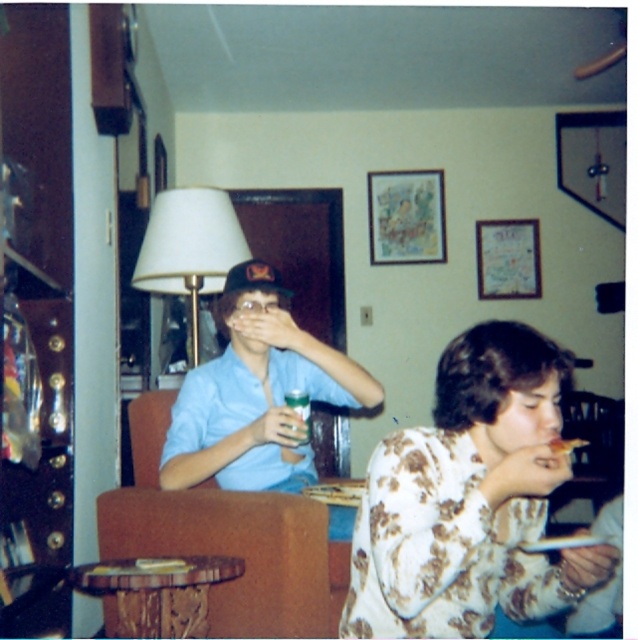
Between white fabric lampshade at upper left and white paper plate at lower right, which one has less height?

white paper plate at lower right is shorter.

Which is behind, point (191, 195) or point (581, 445)?

Point (191, 195)

Find the location of a particular element. The height and width of the screenshot is (640, 638). white fabric lampshade at upper left is located at coordinates (189, 248).

Does floral print blouse at lower right appear under white paper plate at lower right?

Incorrect, floral print blouse at lower right is not positioned below white paper plate at lower right.

Consider the image. Is floral print blouse at lower right closer to the viewer compared to white paper plate at lower right?

That is True.

What do you see at coordinates (470, 499) in the screenshot? Image resolution: width=638 pixels, height=640 pixels. I see `floral print blouse at lower right` at bounding box center [470, 499].

Locate an element on the screen. floral print blouse at lower right is located at coordinates (470, 499).

Which is more to the left, matte blue shirt at center or white paper plate at lower right?

matte blue shirt at center is more to the left.

Does matte blue shirt at center appear under white paper plate at lower right?

No.

Is point (216, 426) closer to camera compared to point (582, 442)?

No.

Locate an element on the screen. This screenshot has width=638, height=640. matte blue shirt at center is located at coordinates (256, 394).